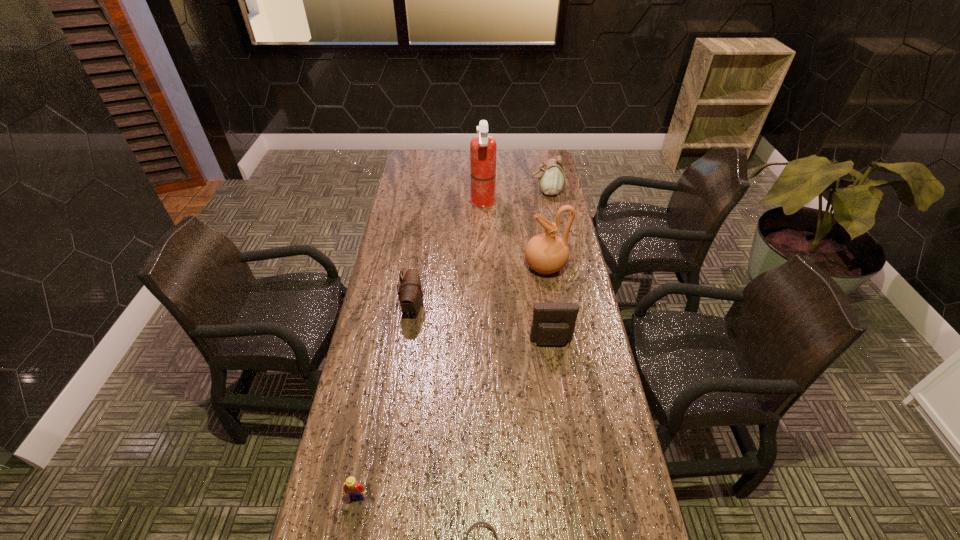
Image resolution: width=960 pixels, height=540 pixels. I want to click on the sixth closest object to the nearest object, so point(551,178).

The image size is (960, 540). I want to click on the second closest object to the farthest pouch, so click(546, 253).

You are a GUI agent. You are given a task and a screenshot of the screen. Output one action in this format:
    pyautogui.click(x=<x>, y=<y>)
    Task: Click on the pouch that is the nearest to the farthest pouch
    The height and width of the screenshot is (540, 960).
    Given the screenshot: What is the action you would take?
    pyautogui.click(x=410, y=293)

Select which pouch is the second closest to the fire extinguisher. Please provide its 2D coordinates. Your answer should be formatted as a tuple, i.e. [(x, y)], where the tuple contains the x and y coordinates of a point satisfying the conditions above.

[(410, 293)]

Identify the location of vacant space that satisfies the following two spatial constraints: 1. on the front-facing side of the farthest pouch; 2. with an open flap on the third nearest object. (575, 342).